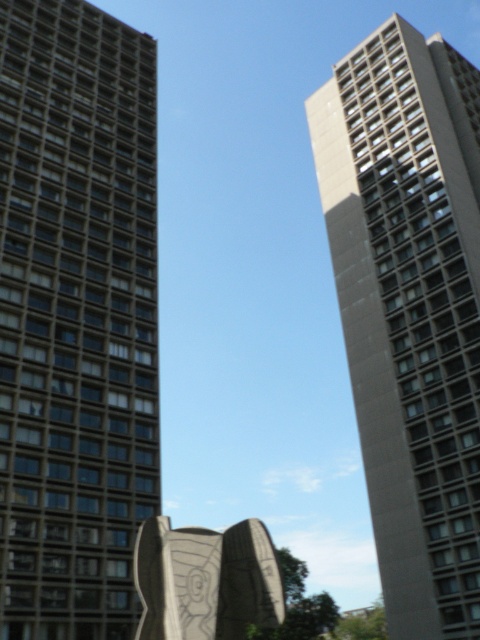
You are an urban planner assessing the space between two buildings in the city. The buildings are the matte gray building at left and the gray concrete building at right. Based on their widths, which building would require more horizontal space if they were to be replicated in a new development project?

The gray concrete building at right requires more horizontal space because it has a greater width than the matte gray building at left.

You are an urban planner assessing the city skyline. You need to determine which of the two buildings, the matte gray building at left or the gray concrete building at right, has a lower height to ensure proper zoning compliance. Based on the scene, which building is shorter?

The matte gray building at left is shorter than the gray concrete building at right, so it is the shorter one and would comply with the zoning requirements for lower height.

You are an urban planner reviewing the city layout. You notice the matte gray building at left and the gray concrete building at right. Which building is closer to the front of the image?

The matte gray building at left is closer to the front of the image because it is positioned over the gray concrete building at right, indicating it is in front.